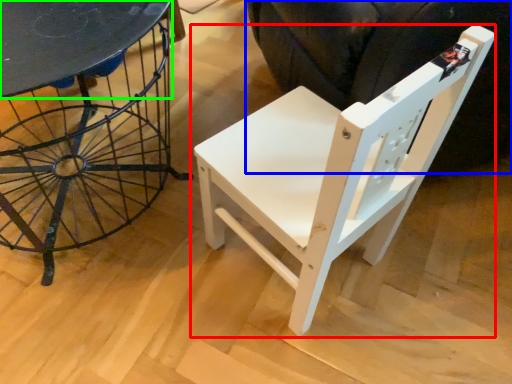
Question: Which object is positioned closest to chair (highlighted by a red box)? Select from swivel chair (highlighted by a blue box) and round table (highlighted by a green box).

Choices:
 (A) swivel chair
 (B) round table

Answer: (A)